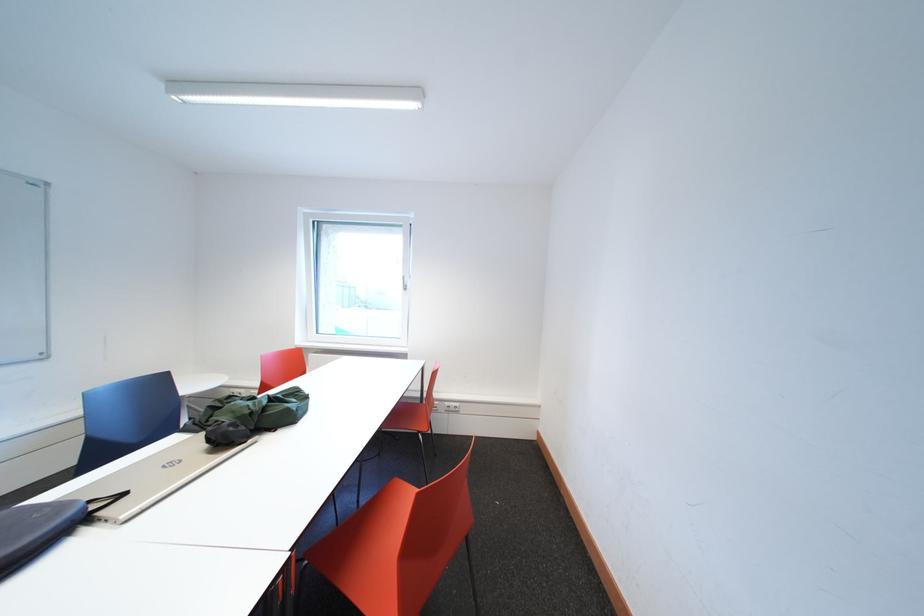
Where would you lift the black laptop sleeve? Please return your answer as a coordinate pair (x, y).

(34, 530)